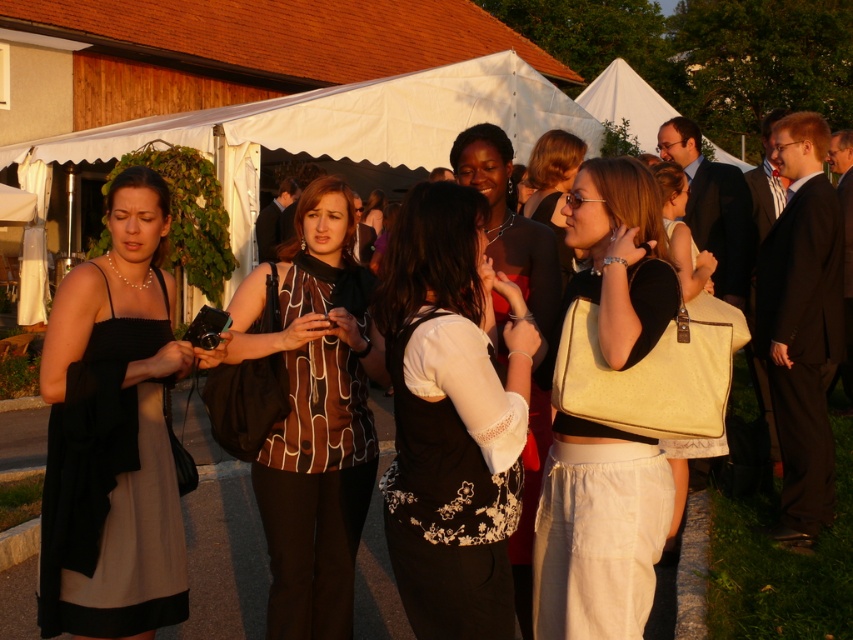
You are a photographer at the event and want to place a small decorative item between the matte cream purse at center and the matte black dress at left. Which object should you place it closer to if you want it to be near the taller one?

The matte cream purse at center is taller than the matte black dress at left, so placing the decorative item closer to the matte cream purse at center would position it near the taller object.

You are organizing a small event and need to place a decorative item on a table. The table has limited space. You have a matte cream purse at center and a matte black dress at left. Which item should you choose to place on the table if you want to maximize the available space?

The matte black dress at left is smaller than the matte cream purse at center, so placing the matte black dress at left on the table would leave more space available.